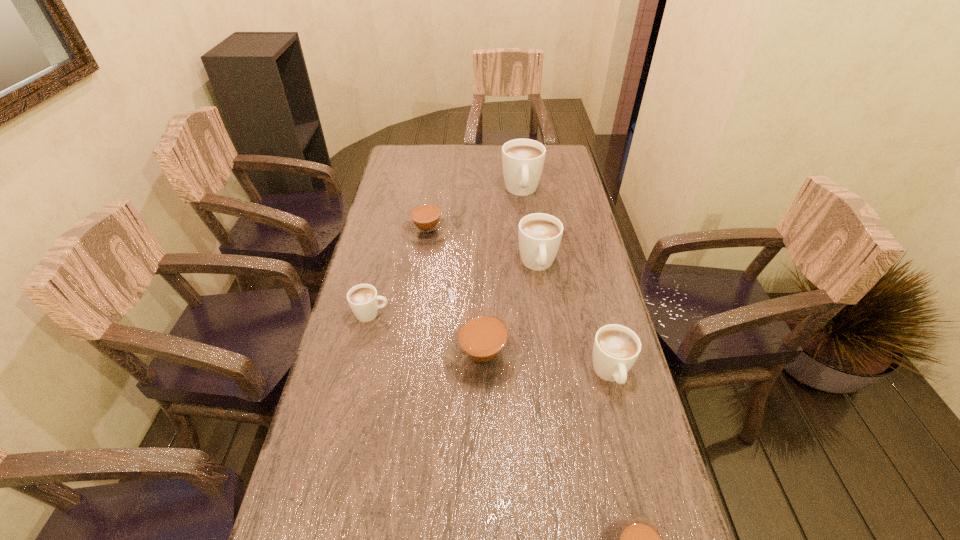
In the image, there is a desktop. At what (x,y) coordinates should I click in order to perform the action: click on vacant space at the far left corner. Please return your answer as a coordinate pair (x, y). The image size is (960, 540). Looking at the image, I should click on (397, 146).

This screenshot has width=960, height=540. Find the location of `empty space between the leftmost white cappuccino and the second farthest brown cappuccino`. empty space between the leftmost white cappuccino and the second farthest brown cappuccino is located at coordinates (427, 335).

Find the location of `vacant area that lies between the leftmost white cappuccino and the biggest white cappuccino`. vacant area that lies between the leftmost white cappuccino and the biggest white cappuccino is located at coordinates (446, 252).

Locate an element on the screen. The width and height of the screenshot is (960, 540). free space between the second farthest brown cappuccino and the rightmost white cappuccino is located at coordinates (547, 364).

Where is `vacant area that lies between the tallest object and the second biggest brown cappuccino`? Image resolution: width=960 pixels, height=540 pixels. vacant area that lies between the tallest object and the second biggest brown cappuccino is located at coordinates (474, 210).

The image size is (960, 540). In order to click on empty location between the third biggest white cappuccino and the biggest brown cappuccino in this screenshot , I will do `click(547, 364)`.

Where is `vacant area between the second smallest white cappuccino and the farthest brown cappuccino`? This screenshot has width=960, height=540. vacant area between the second smallest white cappuccino and the farthest brown cappuccino is located at coordinates (519, 302).

You are a GUI agent. You are given a task and a screenshot of the screen. Output one action in this format:
    pyautogui.click(x=<x>, y=<y>)
    Task: Click on the object that stands as the fifth closest to the nearest brown cappuccino
    This screenshot has width=960, height=540.
    Given the screenshot: What is the action you would take?
    pyautogui.click(x=426, y=224)

Identify which object is located as the second nearest to the second farthest brown cappuccino. Please provide its 2D coordinates. Your answer should be formatted as a tuple, i.e. [(x, y)], where the tuple contains the x and y coordinates of a point satisfying the conditions above.

[(539, 234)]

The image size is (960, 540). What are the coordinates of `cappuccino that is the closest one to the biggest brown cappuccino` in the screenshot? It's located at (363, 299).